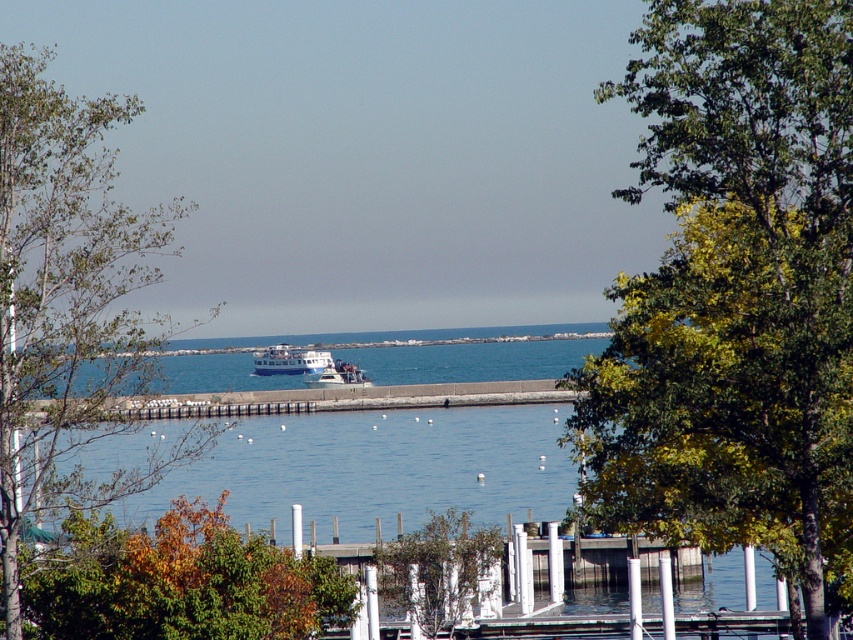
Question: In this image, where is white glossy boat at center located relative to white plastic boat at center?

Choices:
 (A) below
 (B) above

Answer: (B)

Question: Which point is closer to the camera?

Choices:
 (A) white glossy boat at center
 (B) green leafy tree at center right
 (C) green leafy tree at center

Answer: (B)

Question: Does green leafy tree at left appear on the left side of green leafy tree at lower left?

Choices:
 (A) no
 (B) yes

Answer: (B)

Question: Can you confirm if green leafy tree at center right is bigger than green leafy tree at lower left?

Choices:
 (A) no
 (B) yes

Answer: (B)

Question: Which object is positioned farthest from the white glossy boat at center?

Choices:
 (A) green leafy tree at center right
 (B) green leafy tree at left

Answer: (A)

Question: Which object is positioned farthest from the green leafy tree at left?

Choices:
 (A) green leafy tree at center right
 (B) green leafy tree at lower left
 (C) white plastic boat at center
 (D) white glossy boat at center

Answer: (A)